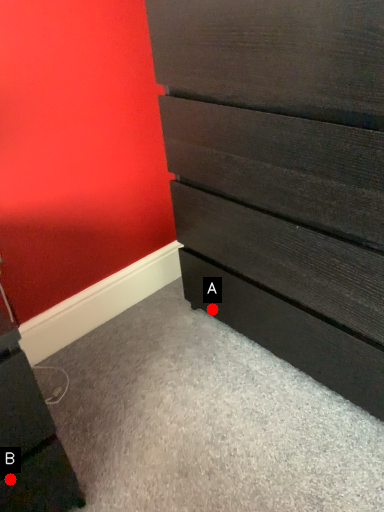
Question: Two points are circled on the image, labeled by A and B beside each circle. Which point appears farthest from the camera in this image?

Choices:
 (A) A is further
 (B) B is further

Answer: (A)